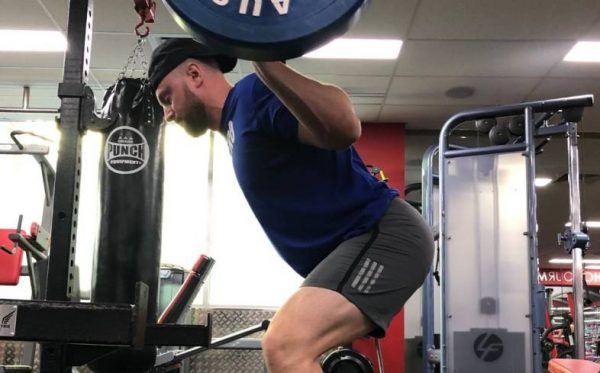
Image resolution: width=600 pixels, height=373 pixels. What are the coordinates of `window` in the screenshot? It's located at (232, 235).